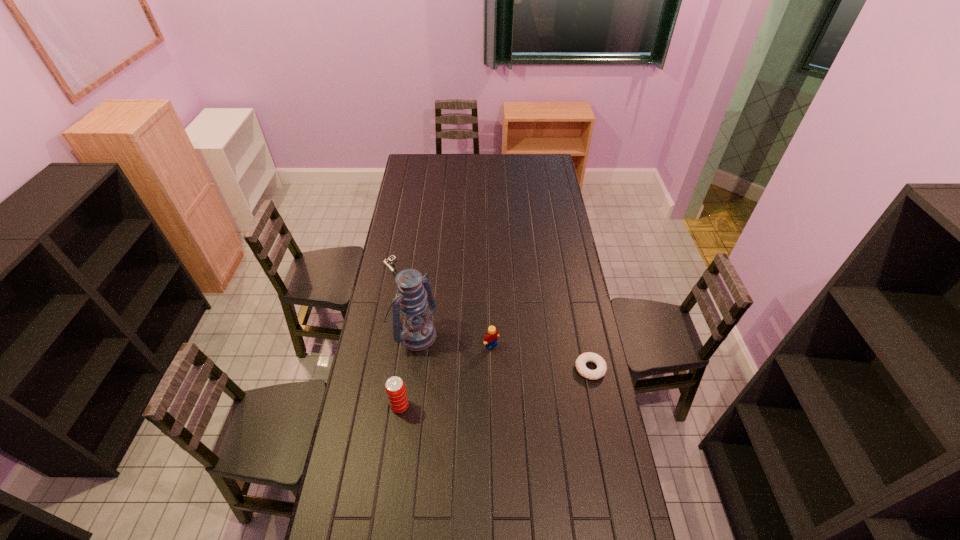
Locate an element on the screen. This screenshot has width=960, height=540. vacant region located on the back of the fourth farthest object is located at coordinates (575, 294).

Locate an element on the screen. This screenshot has width=960, height=540. free spot located 0.080m on the front-facing side of the tallest object is located at coordinates (444, 356).

What are the coordinates of `free space located on the front-facing side of the tallest object` in the screenshot? It's located at 506,401.

Locate an element on the screen. This screenshot has width=960, height=540. blank area located on the front-facing side of the tallest object is located at coordinates (509, 403).

Locate an element on the screen. This screenshot has width=960, height=540. free region located 0.250m on the front-facing side of the pistol is located at coordinates (429, 313).

I want to click on free space located 0.140m on the front-facing side of the pistol, so click(x=416, y=298).

At what (x,y) coordinates should I click in order to perform the action: click on vacant position located on the front-facing side of the pistol. Please return your answer as a coordinate pair (x, y). The image size is (960, 540). Looking at the image, I should click on (417, 299).

Image resolution: width=960 pixels, height=540 pixels. Identify the location of vacant region located 0.320m on the front-facing side of the Lego. pos(550,409).

Find the location of a particular element. The width and height of the screenshot is (960, 540). vacant space located 0.260m on the front-facing side of the Lego is located at coordinates (539, 397).

Where is `vacant region located 0.210m on the front-facing side of the Lego`? The width and height of the screenshot is (960, 540). vacant region located 0.210m on the front-facing side of the Lego is located at coordinates (530, 387).